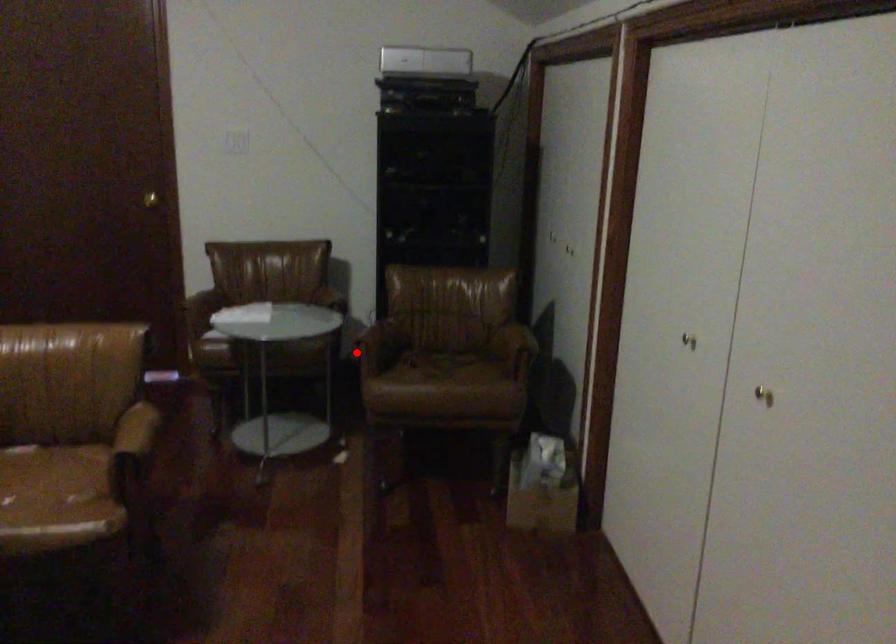
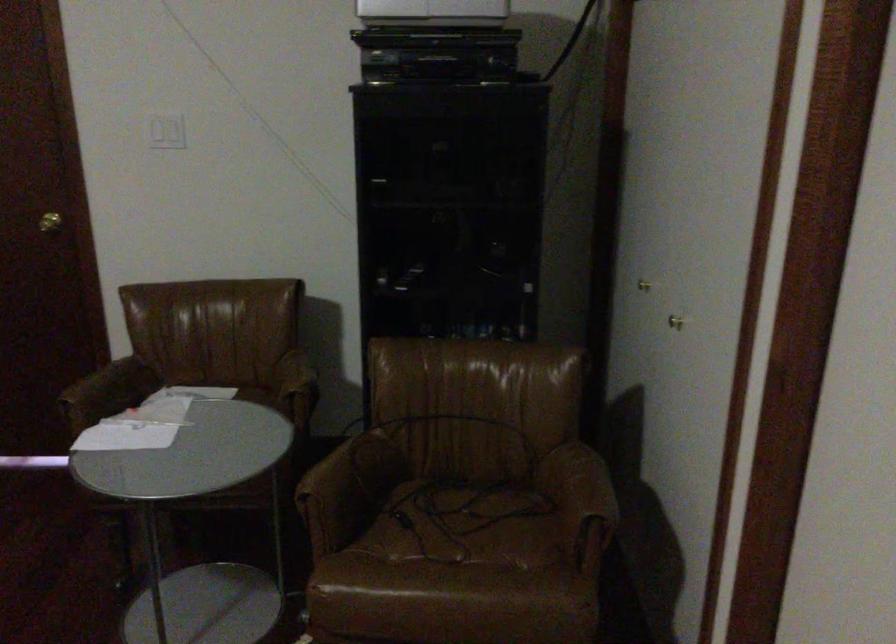
Question: I am providing you with two images of the same scene from different viewpoints. Given a red point in image1, look at the same physical point in image2. Is it:

Choices:
 (A) Closer to the viewpoint
 (B) Farther from the viewpoint

Answer: (A)